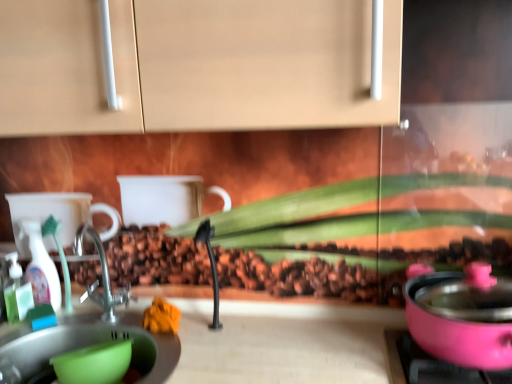
Looking at this image, what is the approximate height of green plastic bowl at lower left?

3.92 inches.

This screenshot has height=384, width=512. Describe the element at coordinates (88, 345) in the screenshot. I see `green plastic bowl at lower left` at that location.

In order to click on green plastic bowl at lower left in this screenshot , I will do `click(88, 345)`.

The width and height of the screenshot is (512, 384). Describe the element at coordinates (41, 268) in the screenshot. I see `translucent plastic spray bottle at left` at that location.

This screenshot has height=384, width=512. I want to click on translucent plastic spray bottle at left, so click(41, 268).

Where is `green plastic bowl at lower left`? The height and width of the screenshot is (384, 512). green plastic bowl at lower left is located at coordinates (88, 345).

Is green plastic bowl at lower left at the left side of translucent plastic spray bottle at left?

In fact, green plastic bowl at lower left is to the right of translucent plastic spray bottle at left.

Is green plastic bowl at lower left in front of or behind translucent plastic spray bottle at left in the image?

green plastic bowl at lower left is positioned closer to the viewer than translucent plastic spray bottle at left.

Is point (27, 351) closer or farther from the camera than point (33, 266)?

Clearly, point (27, 351) is closer to the camera than point (33, 266).

From the image's perspective, is green plastic bowl at lower left on translucent plastic spray bottle at left?

No, from the image's perspective, green plastic bowl at lower left is not over translucent plastic spray bottle at left.

From a real-world perspective, is green plastic bowl at lower left above or below translucent plastic spray bottle at left?

green plastic bowl at lower left is situated lower than translucent plastic spray bottle at left in the real world.

Is green plastic bowl at lower left thinner than translucent plastic spray bottle at left?

Incorrect, the width of green plastic bowl at lower left is not less than that of translucent plastic spray bottle at left.

From their relative heights in the image, would you say green plastic bowl at lower left is taller or shorter than translucent plastic spray bottle at left?

In the image, green plastic bowl at lower left appears to be shorter than translucent plastic spray bottle at left.

Between green plastic bowl at lower left and translucent plastic spray bottle at left, which one has larger size?

green plastic bowl at lower left.

Do you think green plastic bowl at lower left is within translucent plastic spray bottle at left, or outside of it?

green plastic bowl at lower left lies outside translucent plastic spray bottle at left.

Can you see green plastic bowl at lower left touching translucent plastic spray bottle at left?

green plastic bowl at lower left is not next to translucent plastic spray bottle at left, and they're not touching.

Is green plastic bowl at lower left turned away from translucent plastic spray bottle at left?

No, translucent plastic spray bottle at left is not at the back of green plastic bowl at lower left.

How different are the orientations of green plastic bowl at lower left and translucent plastic spray bottle at left in degrees?

0.0029 degrees separate the facing orientations of green plastic bowl at lower left and translucent plastic spray bottle at left.

In the image, there is a green plastic bowl at lower left. In order to click on bottle above it (from the image's perspective) in this screenshot , I will do `click(41, 268)`.

Would you say translucent plastic spray bottle at left is to the left or to the right of green plastic bowl at lower left in the picture?

From the image, it's evident that translucent plastic spray bottle at left is to the left of green plastic bowl at lower left.

Which object is further away from the camera taking this photo, translucent plastic spray bottle at left or green plastic bowl at lower left?

translucent plastic spray bottle at left is behind.

Which is behind, point (36, 280) or point (51, 347)?

Positioned behind is point (36, 280).

From the image's perspective, is translucent plastic spray bottle at left located above or below green plastic bowl at lower left?

Clearly, from the image's perspective, translucent plastic spray bottle at left is above green plastic bowl at lower left.

From a real-world perspective, which is physically above, translucent plastic spray bottle at left or green plastic bowl at lower left?

translucent plastic spray bottle at left, from a real-world perspective.

Considering the sizes of objects translucent plastic spray bottle at left and green plastic bowl at lower left in the image provided, who is wider, translucent plastic spray bottle at left or green plastic bowl at lower left?

green plastic bowl at lower left.

Who is shorter, translucent plastic spray bottle at left or green plastic bowl at lower left?

green plastic bowl at lower left.

Who is smaller, translucent plastic spray bottle at left or green plastic bowl at lower left?

Smaller between the two is translucent plastic spray bottle at left.

Is green plastic bowl at lower left a part of translucent plastic spray bottle at left?

Actually, green plastic bowl at lower left is outside translucent plastic spray bottle at left.

Is translucent plastic spray bottle at left not close to green plastic bowl at lower left?

That's not correct — translucent plastic spray bottle at left is a little close to green plastic bowl at lower left.

Is translucent plastic spray bottle at left oriented away from green plastic bowl at lower left?

No, translucent plastic spray bottle at left is not facing the opposite direction of green plastic bowl at lower left.

Identify the location of sink that is on the right side of translucent plastic spray bottle at left. (88, 345).

Where is `bottle above the green plastic bowl at lower left (from a real-world perspective)`? The height and width of the screenshot is (384, 512). bottle above the green plastic bowl at lower left (from a real-world perspective) is located at coordinates (41, 268).

The height and width of the screenshot is (384, 512). What are the coordinates of `sink in front of the translucent plastic spray bottle at left` in the screenshot? It's located at (88, 345).